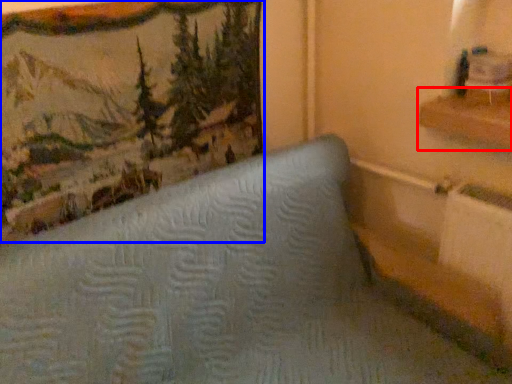
Question: Which object is further to the camera taking this photo, shelf (highlighted by a red box) or picture frame (highlighted by a blue box)?

Choices:
 (A) shelf
 (B) picture frame

Answer: (A)